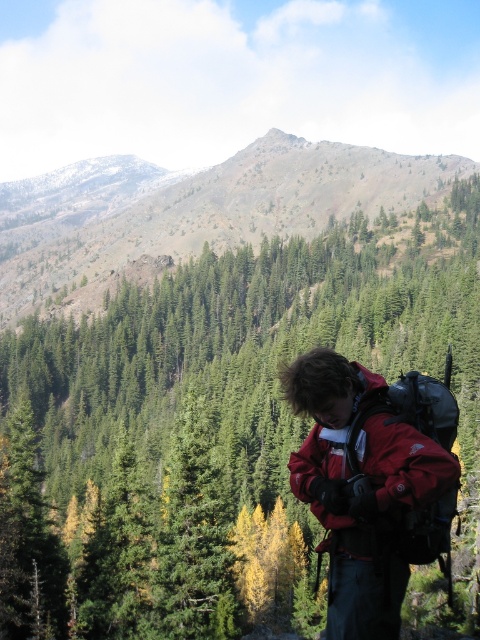
Can you confirm if green textured pine tree at center is bigger than green textured forest at center?

Actually, green textured pine tree at center might be smaller than green textured forest at center.

The width and height of the screenshot is (480, 640). Describe the element at coordinates (219, 429) in the screenshot. I see `green textured pine tree at center` at that location.

Locate an element on the screen. This screenshot has width=480, height=640. green textured pine tree at center is located at coordinates (219, 429).

Between green textured forest at center and matte red jacket at center, which one appears on the right side from the viewer's perspective?

Positioned to the right is matte red jacket at center.

Find the location of `green textured forest at center`. green textured forest at center is located at coordinates pyautogui.click(x=192, y=211).

Is point (382, 177) behind point (310, 413)?

Yes, it is.

Image resolution: width=480 pixels, height=640 pixels. I want to click on green textured forest at center, so click(192, 211).

Does green textured pine tree at center appear on the left side of matte red jacket at center?

Indeed, green textured pine tree at center is positioned on the left side of matte red jacket at center.

Is point (433, 250) positioned before point (454, 458)?

No, (433, 250) is further to viewer.

Which is in front, point (192, 380) or point (439, 532)?

Point (439, 532)

This screenshot has height=640, width=480. Identify the location of green textured pine tree at center. (219, 429).